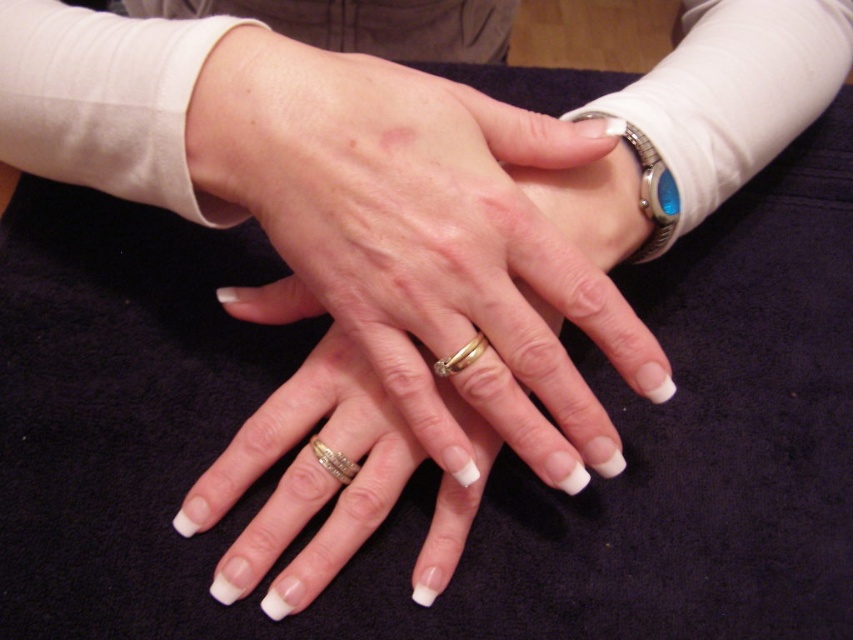
You are trying to determine the spatial relationship between two points in the image. Given that point A is at coordinates point [341,458] and point B is at coordinates point [477,340], which point is closer to the viewer?

Point B at coordinates point [477,340] is closer to the viewer since point A at coordinates point [341,458] is behind it.

You are a jeweler examining two items in the image. You need to determine which item is closer to you. The items are the metallic silver watch at upper right and the gold textured band at center. Which one is closer?

The metallic silver watch at upper right is closer to you because it is further to the viewer than the gold textured band at center.